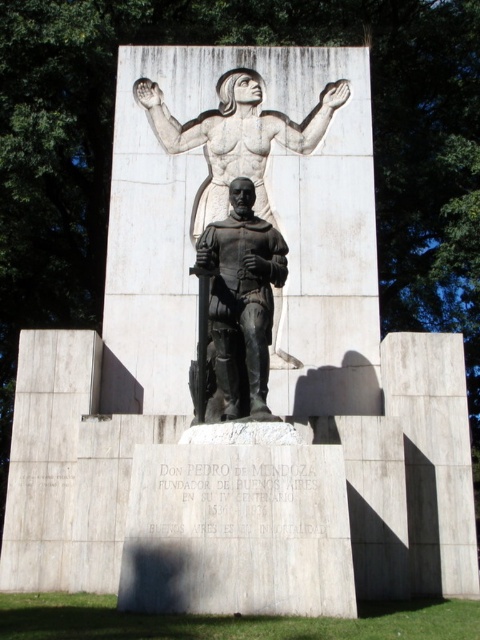
You are an art student analyzing the monument. You notice the bronze statue at center and the smooth stone figure at upper center. Which of these two has a narrower width?

The bronze statue at center is thinner than the smooth stone figure at upper center, so the bronze statue at center has a narrower width.

You are an art conservator working on the Don Pedro de Mendoza monument. You need to install a protective barrier between the smooth stone figure at upper center and the white stone statue at upper center. The barrier must be 3.5 inches wide. Will the current space between them accommodate this barrier?

The distance between the smooth stone figure at upper center and the white stone statue at upper center is 4.03 inches. Since the barrier requires 3.5 inches, there is enough space to install it as 4.03 inches is greater than 3.5 inches.

You are an art historian examining the monument of Don Pedro de Mendoza. You notice two stone figures at the upper center of the monument. Which one is closer to you, the smooth stone figure at upper center or the white stone statue at upper center?

The smooth stone figure at upper center is closer to you because it is in front of the white stone statue at upper center.